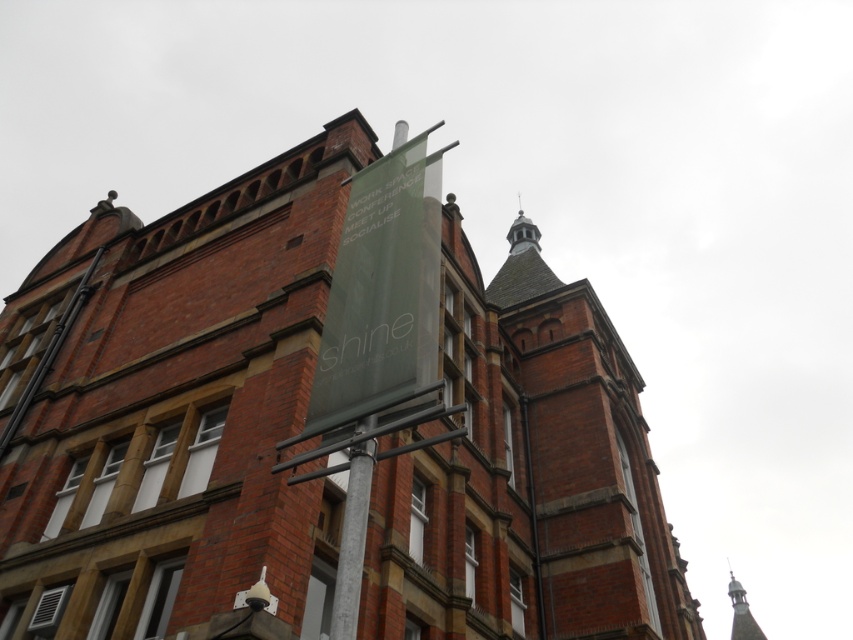
Question: Does green fabric banner at center come in front of red brick tower at upper center?

Choices:
 (A) yes
 (B) no

Answer: (A)

Question: Among these points, which one is nearest to the camera?

Choices:
 (A) (614, 374)
 (B) (520, 301)

Answer: (A)

Question: Among these objects, which one is nearest to the camera?

Choices:
 (A) green fabric banner at center
 (B) red brick tower at upper center

Answer: (A)

Question: Which of the following is the closest to the observer?

Choices:
 (A) (456, 332)
 (B) (547, 296)

Answer: (A)

Question: Does green fabric banner at center have a smaller size compared to red brick tower at upper center?

Choices:
 (A) no
 (B) yes

Answer: (A)

Question: Is green fabric banner at center to the right of red brick tower at upper center from the viewer's perspective?

Choices:
 (A) yes
 (B) no

Answer: (B)